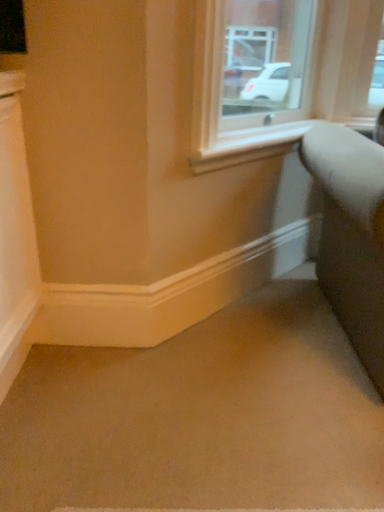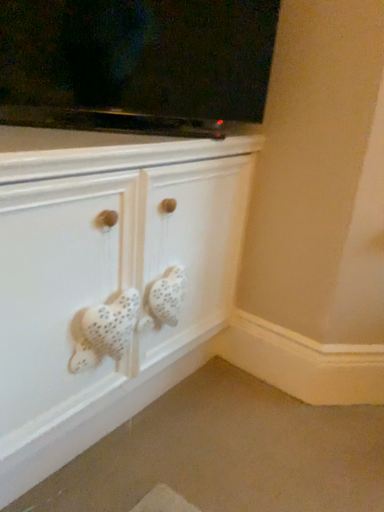
Question: How did the camera likely rotate when shooting the video?

Choices:
 (A) rotated right
 (B) rotated left

Answer: (B)